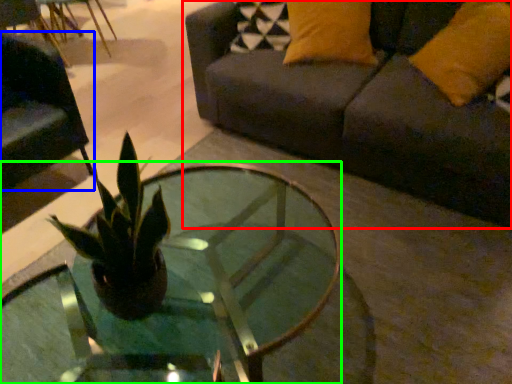
Question: Which is farther away from studio couch (highlighted by a red box)? swivel chair (highlighted by a blue box) or coffee table (highlighted by a green box)?

Choices:
 (A) swivel chair
 (B) coffee table

Answer: (A)